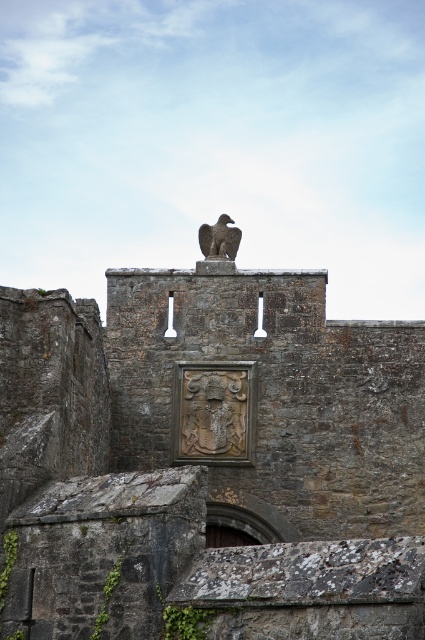
You are an architect examining the historic stone structure. You need to place a new decorative element exactly at the center of the stone eagle at center. What coordinates should you use for placement?

The stone eagle at center is located at coordinates [209,464], so you should place the new decorative element at those coordinates.